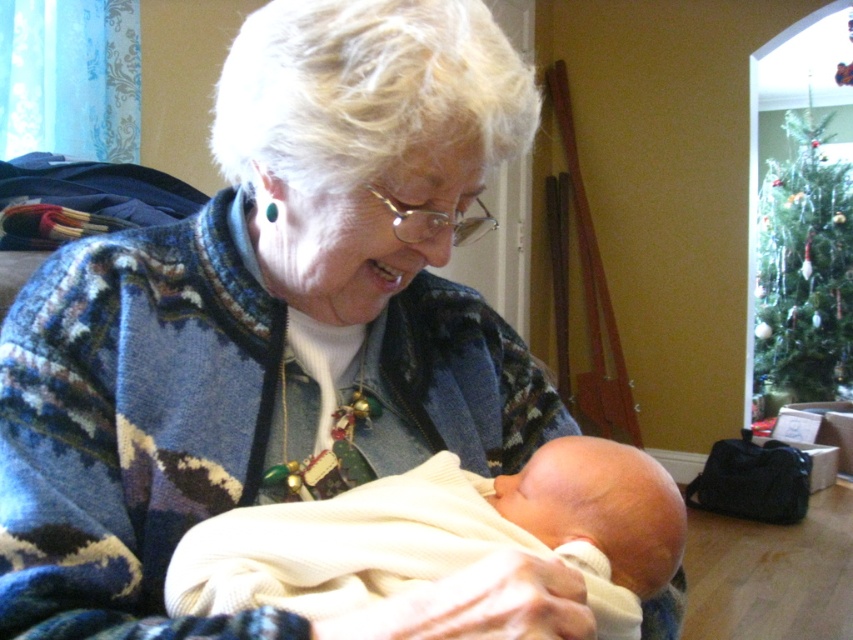
Question: Which point is closer to the camera?

Choices:
 (A) green matte christmas tree at upper right
 (B) white knit sweater at center

Answer: (B)

Question: Is white knit sweater at center further to the viewer compared to green matte christmas tree at upper right?

Choices:
 (A) no
 (B) yes

Answer: (A)

Question: Does white knit sweater at center have a lesser width compared to green matte christmas tree at upper right?

Choices:
 (A) no
 (B) yes

Answer: (B)

Question: Does white knit sweater at center have a greater width compared to green matte christmas tree at upper right?

Choices:
 (A) no
 (B) yes

Answer: (A)

Question: Among these objects, which one is nearest to the camera?

Choices:
 (A) green matte christmas tree at upper right
 (B) white knit sweater at center

Answer: (B)